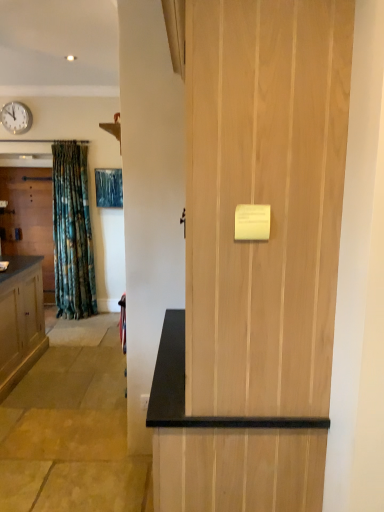
The image size is (384, 512). What do you see at coordinates (16, 118) in the screenshot?
I see `white plastic clock at upper left` at bounding box center [16, 118].

What are the coordinates of `white plastic clock at upper left` in the screenshot? It's located at (16, 118).

How distant is natural wood door at center, the second door when ordered from left to right, from white plastic clock at upper left?

The distance of natural wood door at center, the second door when ordered from left to right, from white plastic clock at upper left is 15.55 feet.

Based on the photo, is natural wood door at center, the first door positioned from the front, looking in the opposite direction of white plastic clock at upper left?

That's not correct — natural wood door at center, the first door positioned from the front, is not looking away from white plastic clock at upper left.

From a real-world perspective, is natural wood door at center, the first door when ordered from right to left, located beneath white plastic clock at upper left?

Yes.

Who is more distant, natural wood door at center, the first door positioned from the front, or white plastic clock at upper left?

white plastic clock at upper left.

Considering the sizes of matte wood door at left, which ranks as the first door in left-to-right order, and natural wood door at center, the second door positioned from the back, in the image, is matte wood door at left, which ranks as the first door in left-to-right order, wider or thinner than natural wood door at center, the second door positioned from the back,?

Clearly, matte wood door at left, which ranks as the first door in left-to-right order, has less width compared to natural wood door at center, the second door positioned from the back.

Between matte wood door at left, the 2th door in the front-to-back sequence, and natural wood door at center, the first door when ordered from right to left, which one is positioned behind?

matte wood door at left, the 2th door in the front-to-back sequence, is behind.

Looking at this image, can we say matte wood door at left, which ranks as the first door in left-to-right order, lies outside natural wood door at center, the first door positioned from the front?

That's correct, matte wood door at left, which ranks as the first door in left-to-right order, is outside of natural wood door at center, the first door positioned from the front.

From their relative heights in the image, would you say matte wood door at left, the 2th door in the front-to-back sequence, is taller or shorter than natural wood door at center, the second door when ordered from left to right?

In the image, matte wood door at left, the 2th door in the front-to-back sequence, appears to be shorter than natural wood door at center, the second door when ordered from left to right.

Considering the positions of points (16, 116) and (7, 236), is point (16, 116) farther from camera compared to point (7, 236)?

No, (16, 116) is in front of (7, 236).

Is white plastic clock at upper left oriented towards matte wood door at left, which ranks as the 1th door in back-to-front order?

No, white plastic clock at upper left is not turned towards matte wood door at left, which ranks as the 1th door in back-to-front order.

Is white plastic clock at upper left in front of or behind matte wood door at left, the 2th door in the front-to-back sequence, in the image?

white plastic clock at upper left is in front of matte wood door at left, the 2th door in the front-to-back sequence.

Does matte wood door at left, the 2th door in the front-to-back sequence, have a greater height compared to white plastic clock at upper left?

Indeed, matte wood door at left, the 2th door in the front-to-back sequence, has a greater height compared to white plastic clock at upper left.

From a real-world perspective, is matte wood door at left, the 2th door in the front-to-back sequence, positioned over white plastic clock at upper left based on gravity?

No.

Is matte wood door at left, which ranks as the 1th door in back-to-front order, turned away from white plastic clock at upper left?

No, white plastic clock at upper left is not at the back of matte wood door at left, which ranks as the 1th door in back-to-front order.

Does matte wood door at left, which ranks as the 1th door in back-to-front order, appear on the right side of white plastic clock at upper left?

Incorrect, matte wood door at left, which ranks as the 1th door in back-to-front order, is not on the right side of white plastic clock at upper left.

Find the location of `door on the left of natural wood door at center, the first door positioned from the front`. door on the left of natural wood door at center, the first door positioned from the front is located at coordinates (29, 218).

Is natural wood door at center, the second door when ordered from left to right, looking in the opposite direction of matte wood door at left, the 2th door in the front-to-back sequence?

No, natural wood door at center, the second door when ordered from left to right, is not facing the opposite direction of matte wood door at left, the 2th door in the front-to-back sequence.

From a real-world perspective, which object stands above the other?

natural wood door at center, the second door positioned from the back, is physically above.

Is point (218, 250) positioned after point (35, 251)?

No, (218, 250) is in front of (35, 251).

Considering the relative sizes of white plastic clock at upper left and natural wood door at center, the second door positioned from the back, in the image provided, is white plastic clock at upper left thinner than natural wood door at center, the second door positioned from the back,?

Yes, white plastic clock at upper left is thinner than natural wood door at center, the second door positioned from the back.

In the scene shown: Who is smaller, white plastic clock at upper left or natural wood door at center, the second door when ordered from left to right?

With smaller size is white plastic clock at upper left.

Does white plastic clock at upper left have a greater height compared to natural wood door at center, the second door when ordered from left to right?

No, white plastic clock at upper left is not taller than natural wood door at center, the second door when ordered from left to right.

Which is in front, point (21, 125) or point (311, 84)?

Point (311, 84)

Identify the location of clock behind the natural wood door at center, the first door positioned from the front. (16, 118).

Image resolution: width=384 pixels, height=512 pixels. Find the location of `door that appears on the left of natural wood door at center, the first door positioned from the front`. door that appears on the left of natural wood door at center, the first door positioned from the front is located at coordinates (29, 218).

Which object lies nearer to the anchor point natural wood door at center, the first door when ordered from right to left, white plastic clock at upper left or matte wood door at left, arranged as the 2th door when viewed from the right?

matte wood door at left, arranged as the 2th door when viewed from the right.

Looking at the image, which one is located further to white plastic clock at upper left, natural wood door at center, the first door positioned from the front, or matte wood door at left, the 2th door in the front-to-back sequence?

The object further to white plastic clock at upper left is natural wood door at center, the first door positioned from the front.

Which object lies nearer to the anchor point natural wood door at center, the first door positioned from the front, matte wood door at left, which ranks as the 1th door in back-to-front order, or white plastic clock at upper left?

The object closer to natural wood door at center, the first door positioned from the front, is matte wood door at left, which ranks as the 1th door in back-to-front order.

Considering their positions, is matte wood door at left, arranged as the 2th door when viewed from the right, positioned closer to white plastic clock at upper left than natural wood door at center, the first door when ordered from right to left?

matte wood door at left, arranged as the 2th door when viewed from the right, is closer to white plastic clock at upper left.

Looking at this image, looking at the image, which one is located further to matte wood door at left, arranged as the 2th door when viewed from the right, white plastic clock at upper left or natural wood door at center, the second door when ordered from left to right?

Based on the image, natural wood door at center, the second door when ordered from left to right, appears to be further to matte wood door at left, arranged as the 2th door when viewed from the right.

When comparing their distances from matte wood door at left, the 2th door in the front-to-back sequence, does natural wood door at center, the first door positioned from the front, or white plastic clock at upper left seem closer?

white plastic clock at upper left is positioned closer to the anchor matte wood door at left, the 2th door in the front-to-back sequence.

This screenshot has height=512, width=384. I want to click on clock positioned between natural wood door at center, the first door when ordered from right to left, and matte wood door at left, the 2th door in the front-to-back sequence, from near to far, so click(x=16, y=118).